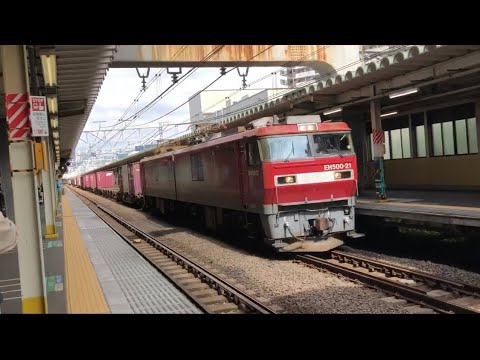
The image size is (480, 360). I want to click on pillars, so click(28, 218), click(48, 210), click(55, 196), click(377, 165).